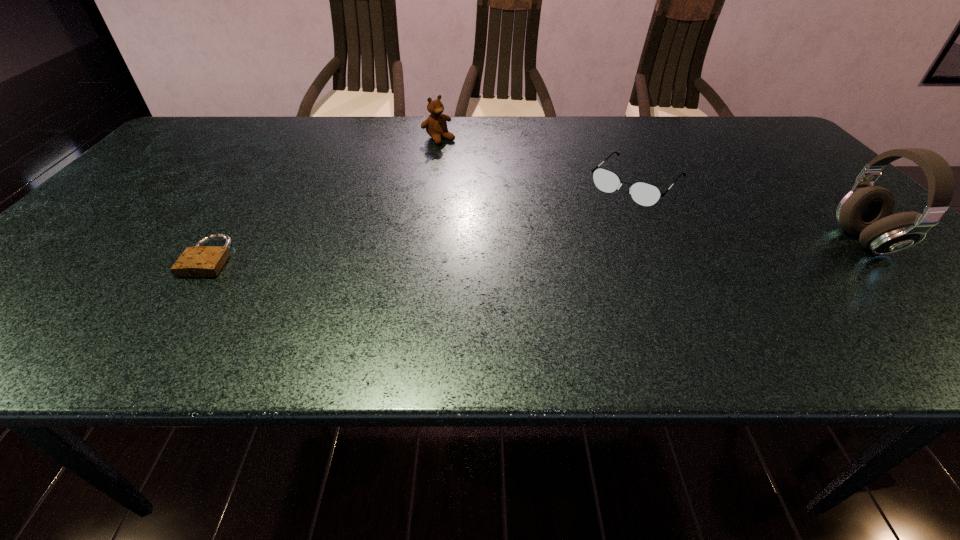
Identify the location of free space that is in between the teddy bear and the leftmost object. (324, 198).

You are a GUI agent. You are given a task and a screenshot of the screen. Output one action in this format:
    pyautogui.click(x=<x>, y=<y>)
    Task: Click on the vacant area between the tallest object and the third nearest object
    The image size is (960, 540).
    Given the screenshot: What is the action you would take?
    pos(751,212)

Choose which object is the nearest neighbor to the spectacles. Please provide its 2D coordinates. Your answer should be formatted as a tuple, i.e. [(x, y)], where the tuple contains the x and y coordinates of a point satisfying the conditions above.

[(866, 211)]

Where is `object that is the closest to the tallest object`? The height and width of the screenshot is (540, 960). object that is the closest to the tallest object is located at coordinates (645, 194).

Find the location of a particular element. Image resolution: width=960 pixels, height=540 pixels. vacant point that satisfies the following two spatial constraints: 1. on the front side of the farthest object; 2. on the ear cups of the rightmost object is located at coordinates (423, 241).

Locate an element on the screen. The image size is (960, 540). free space that satisfies the following two spatial constraints: 1. on the front side of the rightmost object; 2. on the ear cups of the third nearest object is located at coordinates (665, 241).

At what (x,y) coordinates should I click in order to perform the action: click on vacant area that satisfies the following two spatial constraints: 1. on the front side of the third shortest object; 2. on the ear cups of the tallest object. Please return your answer as a coordinate pair (x, y). Looking at the image, I should click on (423, 241).

At what (x,y) coordinates should I click in order to perform the action: click on free space that satisfies the following two spatial constraints: 1. on the front side of the third tallest object; 2. on the ear cups of the tallest object. Please return your answer as a coordinate pair (x, y). This screenshot has height=540, width=960. Looking at the image, I should click on click(665, 241).